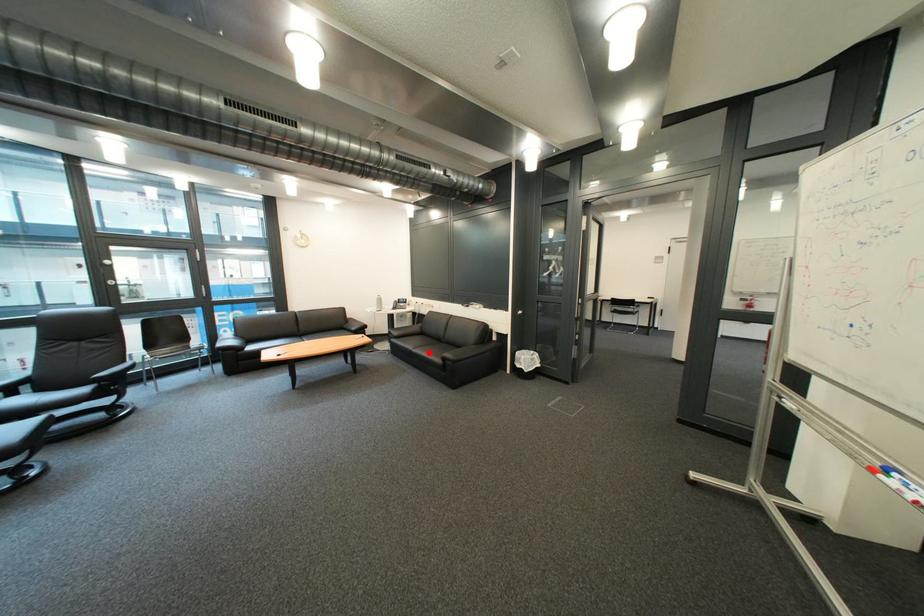
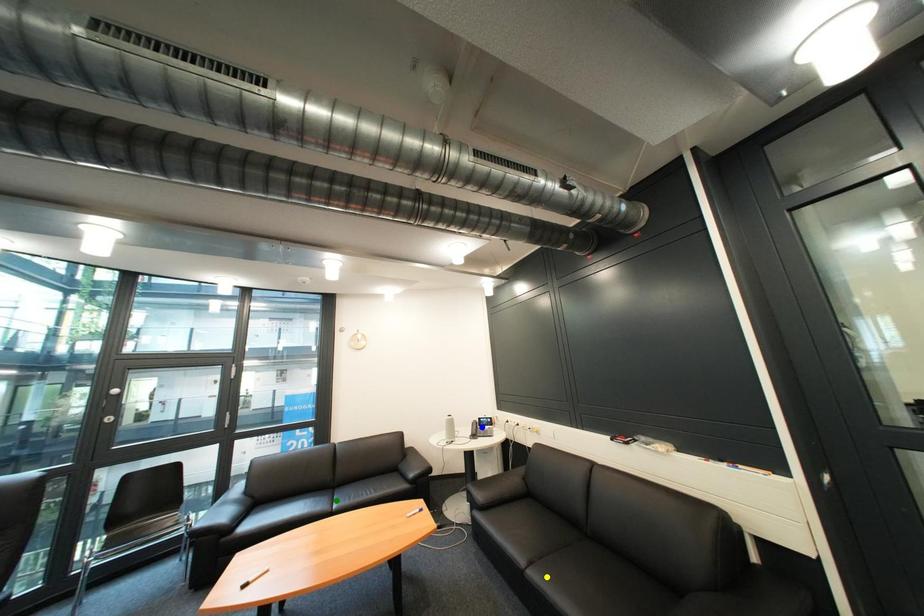
Question: I am providing you with two images of the same scene from different viewpoints. A red point is marked on the first image. You are given multiple points on the second image. Can you choose the point in image 2 that corresponds to the point in image 1?

Choices:
 (A) green point
 (B) yellow point
 (C) blue point

Answer: (B)